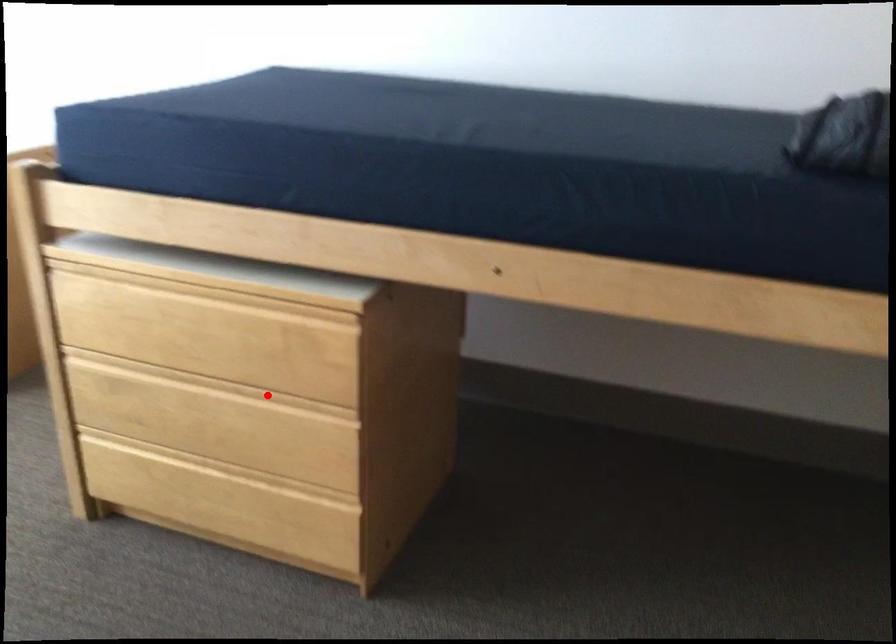
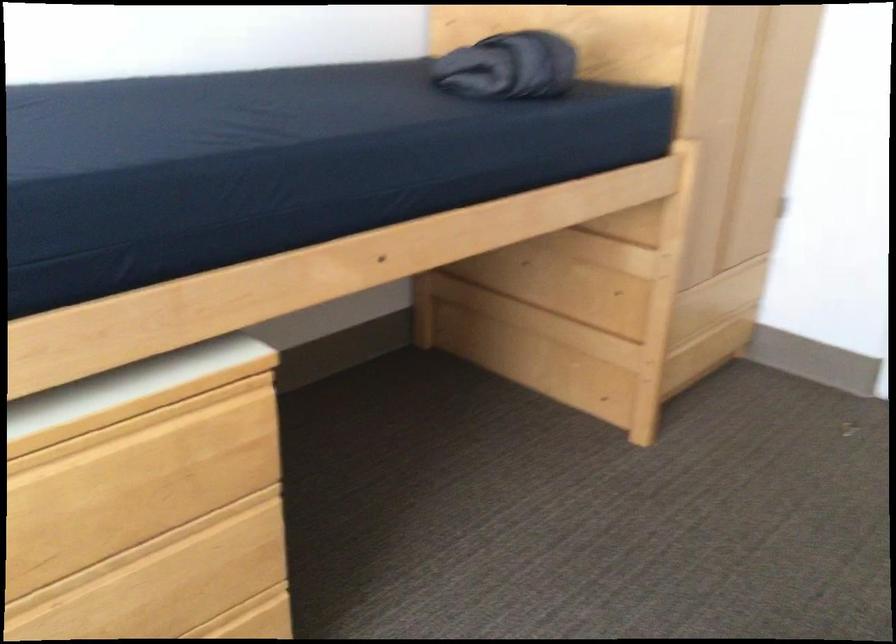
Question: I am providing you with two images of the same scene from different viewpoints. A red point is shown in image1. For the corresponding object point in image2, is it positioned nearer or farther from the camera?

Choices:
 (A) Nearer
 (B) Farther

Answer: (A)